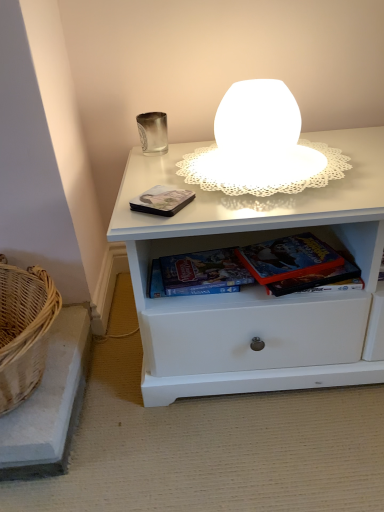
Question: Which direction should I rotate to look at white frosted glass table lamp at upper center?

Choices:
 (A) right
 (B) left

Answer: (A)

Question: Is metallic matte book at center, arranged as the first paperback book when viewed from the left, not near hardcover book at center, the second paperback book in the left-to-right sequence?

Choices:
 (A) no
 (B) yes

Answer: (A)

Question: Does metallic matte book at center, arranged as the first paperback book when viewed from the left, have a greater width compared to hardcover book at center, which ranks as the second paperback book in right-to-left order?

Choices:
 (A) no
 (B) yes

Answer: (B)

Question: Does metallic matte book at center, the third paperback book in the right-to-left sequence, turn towards hardcover book at center, the second paperback book in the left-to-right sequence?

Choices:
 (A) no
 (B) yes

Answer: (A)

Question: From a real-world perspective, does metallic matte book at center, arranged as the first paperback book when viewed from the left, sit lower than hardcover book at center, the second paperback book in the left-to-right sequence?

Choices:
 (A) no
 (B) yes

Answer: (A)

Question: Considering the relative sizes of metallic matte book at center, arranged as the first paperback book when viewed from the left, and hardcover book at center, which ranks as the second paperback book in right-to-left order, in the image provided, is metallic matte book at center, arranged as the first paperback book when viewed from the left, shorter than hardcover book at center, which ranks as the second paperback book in right-to-left order,?

Choices:
 (A) yes
 (B) no

Answer: (A)

Question: Is metallic matte book at center, arranged as the first paperback book when viewed from the left, placed right next to hardcover book at center, the second paperback book in the left-to-right sequence?

Choices:
 (A) yes
 (B) no

Answer: (B)

Question: Is woven wicker basket at lower left oriented away from metallic matte book at center, arranged as the first paperback book when viewed from the left?

Choices:
 (A) yes
 (B) no

Answer: (B)

Question: Is woven wicker basket at lower left shorter than metallic matte book at center, the third paperback book in the right-to-left sequence?

Choices:
 (A) no
 (B) yes

Answer: (A)

Question: From the image's perspective, does woven wicker basket at lower left appear lower than metallic matte book at center, the third paperback book in the right-to-left sequence?

Choices:
 (A) yes
 (B) no

Answer: (A)

Question: Is woven wicker basket at lower left far from metallic matte book at center, arranged as the first paperback book when viewed from the left?

Choices:
 (A) no
 (B) yes

Answer: (A)

Question: Is woven wicker basket at lower left further to camera compared to metallic matte book at center, arranged as the first paperback book when viewed from the left?

Choices:
 (A) no
 (B) yes

Answer: (A)

Question: Is woven wicker basket at lower left located outside metallic matte book at center, arranged as the first paperback book when viewed from the left?

Choices:
 (A) yes
 (B) no

Answer: (A)

Question: Is hardcover book at lower center, which ranks as the third paperback book in left-to-right order, facing away from white frosted glass table lamp at upper center?

Choices:
 (A) no
 (B) yes

Answer: (A)